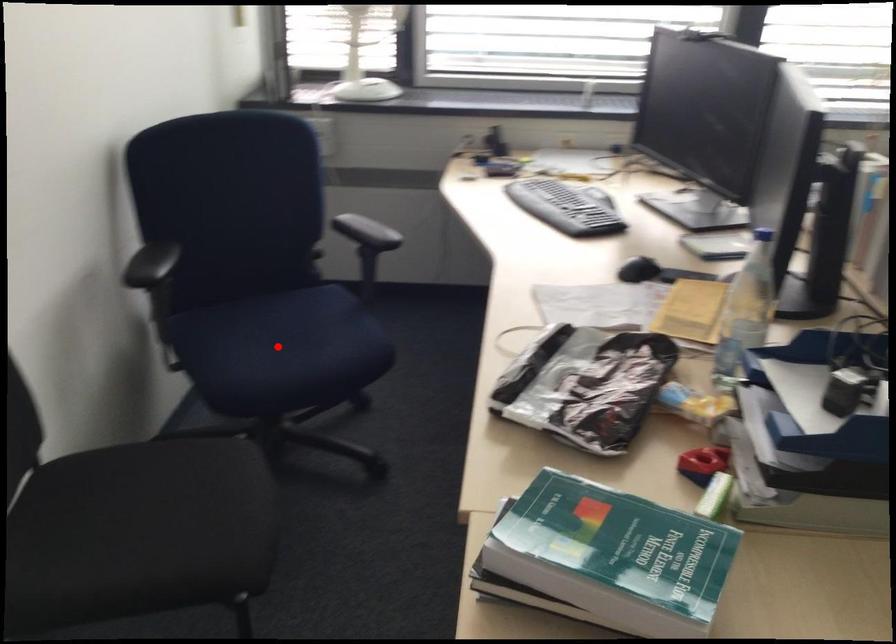
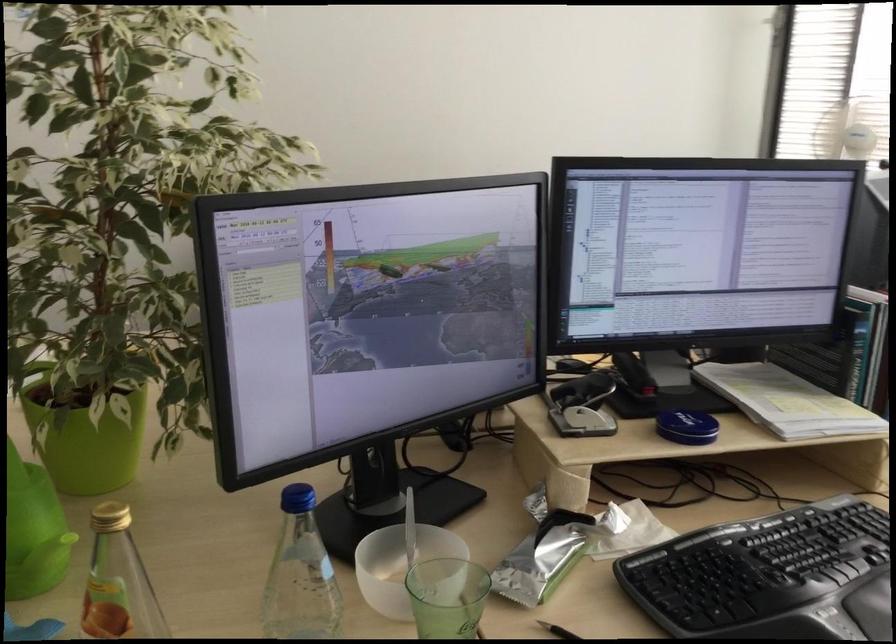
Question: I am providing you with two images of the same scene from different viewpoints. A red point is marked on the first image. Can you still see the location of the red point in image 2?

Choices:
 (A) Yes
 (B) No

Answer: (B)